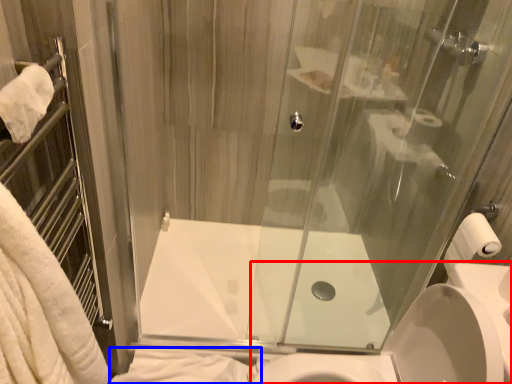
Question: Which point is closer to the camera, sink (highlighted by a red box) or bath towel (highlighted by a blue box)?

Choices:
 (A) sink
 (B) bath towel

Answer: (A)